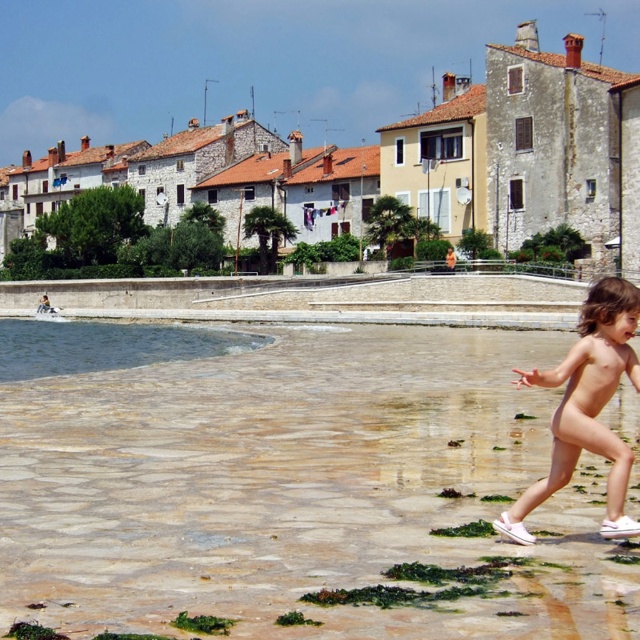
You are standing at the origin point in the image. Which direction should you move to reach the clear stone water at lower left?

The clear stone water at lower left is located at coordinates 0.766 on the x axis and 0.472 on the y axis. Since you are at the origin point, you should move towards the lower left direction to reach it.

You are a photographer standing at the center of the stone paved area. You want to capture a photo of both the clear stone water at lower left and the clear water at lower left in the same frame. Given that your camera has a maximum focal length that allows capturing objects within 20 meters of each other, will you be able to include both in the photo?

The clear stone water at lower left and the clear water at lower left are 20.11 meters apart. Since the distance between them exceeds the camera maximum focal length of 20 meters, you cannot capture both in the same frame.

You are standing at the point labeled point (323, 628) and want to walk to the point labeled point (109, 365). Which direction should you move to get closer to your destination?

You should move away from the camera because point (109, 365) is further from the camera than point (323, 628).